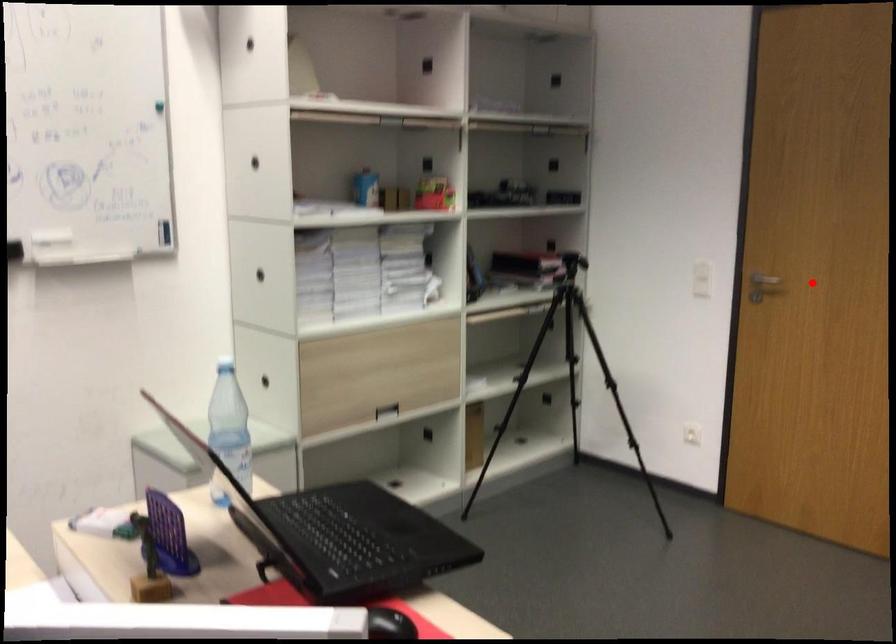
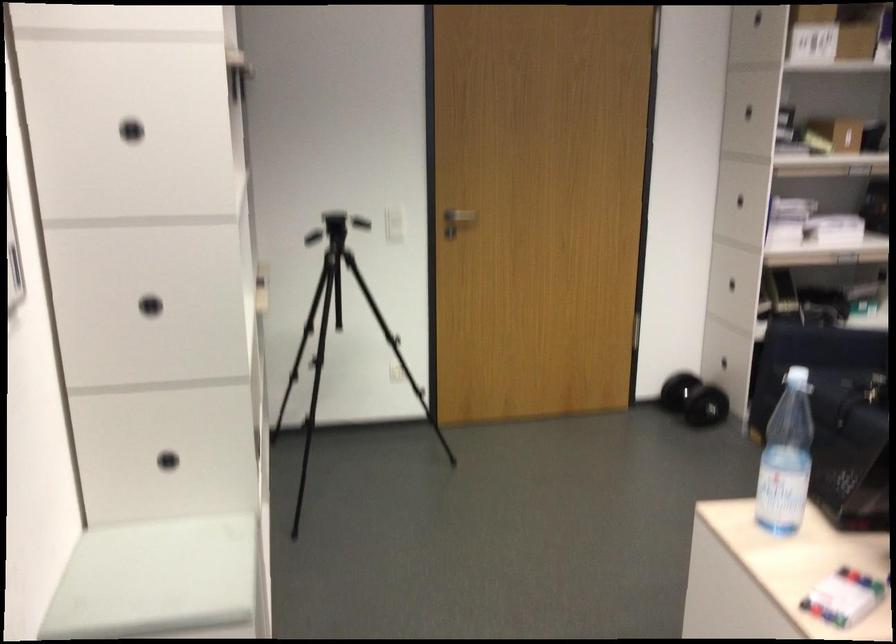
The point at the highlighted location is marked in the first image. Where is the corresponding point in the second image?

(460, 216)